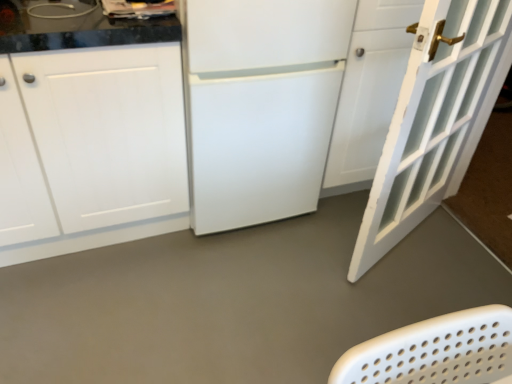
Question: Is point (395, 145) positioned closer to the camera than point (58, 76)?

Choices:
 (A) farther
 (B) closer

Answer: (A)

Question: From the image's perspective, is white painted wood door at right located above or below white matte cabinet at left?

Choices:
 (A) above
 (B) below

Answer: (B)

Question: Estimate the real-world distances between objects in this image. Which object is closer to the gray matte floor at center?

Choices:
 (A) white matte cabinet at left
 (B) white painted wood door at right
 (C) white matte refrigerator at center

Answer: (B)

Question: Estimate the real-world distances between objects in this image. Which object is farther from the white matte refrigerator at center?

Choices:
 (A) gray matte floor at center
 (B) white matte cabinet at left
 (C) white painted wood door at right

Answer: (A)